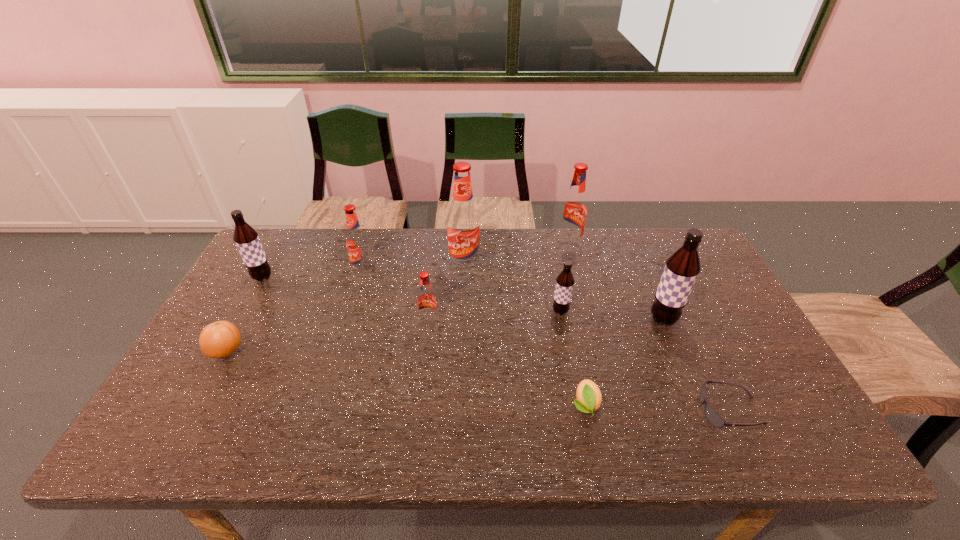
Find the location of a particular element. free location located 0.380m on the left of the second root beer from right to left is located at coordinates (444, 246).

I want to click on vacant space situated on the right of the rightmost root beer, so click(699, 320).

Identify the location of vacant space located 0.280m on the right of the leftmost red root beer. The width and height of the screenshot is (960, 540). (462, 271).

You are a GUI agent. You are given a task and a screenshot of the screen. Output one action in this format:
    pyautogui.click(x=<x>, y=<y>)
    Task: Click on the vacant space located 0.210m on the back of the farthest brown root beer
    The width and height of the screenshot is (960, 540).
    Given the screenshot: What is the action you would take?
    pyautogui.click(x=288, y=232)

Identify the location of vacant area situated 0.190m on the right of the smallest red root beer. The image size is (960, 540). (506, 323).

Locate an element on the screen. The height and width of the screenshot is (540, 960). vacant space located on the front of the second brown root beer from left to right is located at coordinates 566,342.

Where is `free location located on the back of the orange`? The height and width of the screenshot is (540, 960). free location located on the back of the orange is located at coordinates (256, 296).

At what (x,y) coordinates should I click in order to perform the action: click on vacant space located 0.060m with leaves positioned above the lemon. Please return your answer as a coordinate pair (x, y). Looking at the image, I should click on click(x=594, y=448).

Locate an element on the screen. Image resolution: width=960 pixels, height=540 pixels. free space located 0.260m on the lenses of the sunglasses is located at coordinates (588, 410).

In order to click on free spot located 0.070m on the lenses of the sunglasses in this screenshot , I will do `click(671, 410)`.